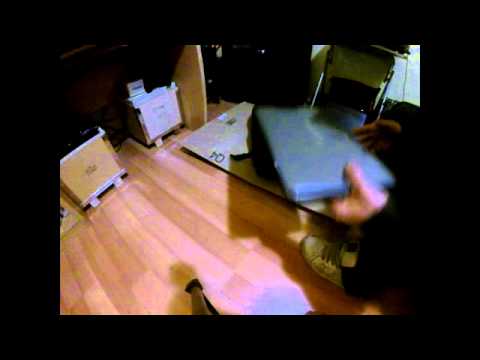
The image size is (480, 360). What are the coordinates of `wood floor` in the screenshot? It's located at (196, 236).